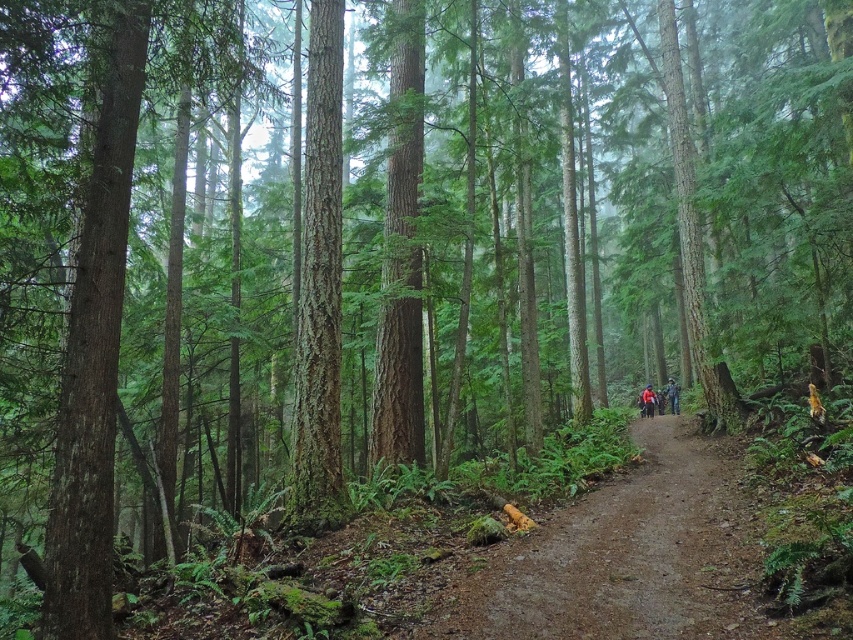
Is dirt path at center positioned before green camouflage jacket at center-right?

Yes, it is.

Does point (595, 600) come closer to viewer compared to point (671, 403)?

Yes, point (595, 600) is in front of point (671, 403).

Identify the location of dirt path at center. The height and width of the screenshot is (640, 853). (631, 554).

Between dirt path at center and red fabric jacket at center-right, which one appears on the right side from the viewer's perspective?

red fabric jacket at center-right

Between point (715, 474) and point (646, 387), which one is positioned behind?

The point (646, 387) is behind.

What do you see at coordinates (631, 554) in the screenshot? The image size is (853, 640). I see `dirt path at center` at bounding box center [631, 554].

This screenshot has width=853, height=640. I want to click on dirt path at center, so click(x=631, y=554).

Measure the distance between red fabric jacket at center-right and camera.

The distance of red fabric jacket at center-right from camera is 25.32 meters.

In the scene shown: Who is more distant from viewer, (x=647, y=397) or (x=671, y=384)?

Positioned behind is point (x=647, y=397).

Where is `red fabric jacket at center-right`? red fabric jacket at center-right is located at coordinates (647, 401).

Identify the location of red fabric jacket at center-right. The height and width of the screenshot is (640, 853). (647, 401).